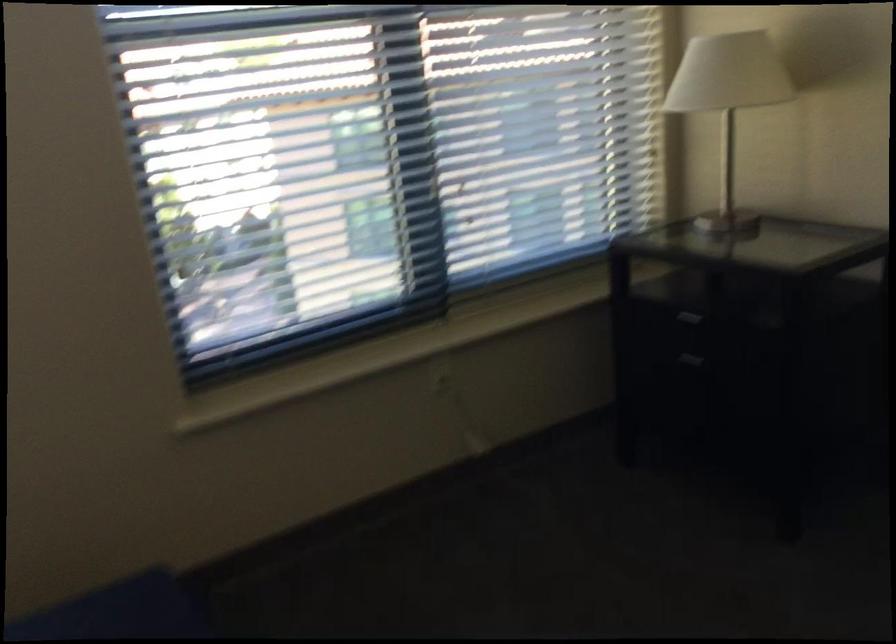
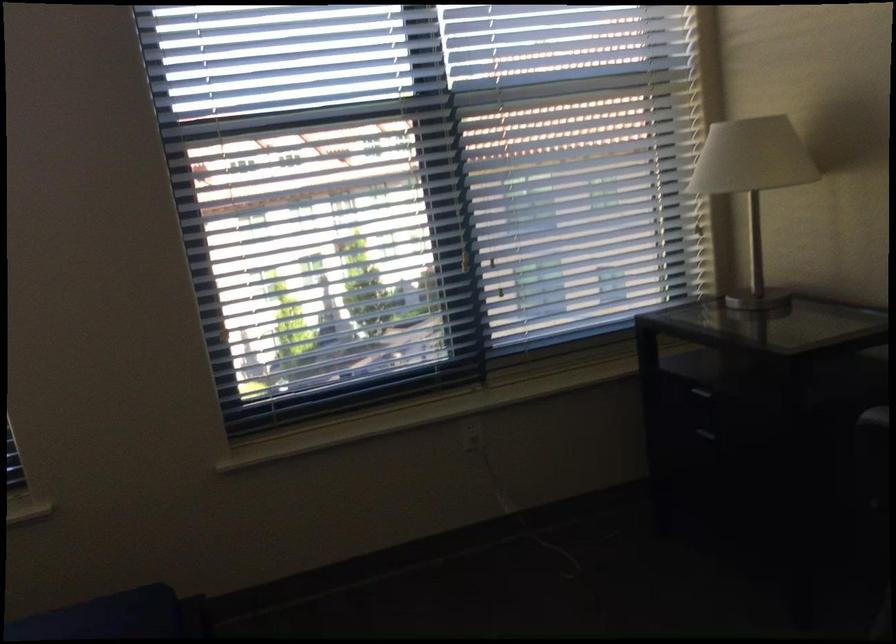
Question: In a continuous first-person perspective shot, in which direction is the camera moving?

Choices:
 (A) Left
 (B) Right
 (C) Forward
 (D) Backward

Answer: (B)